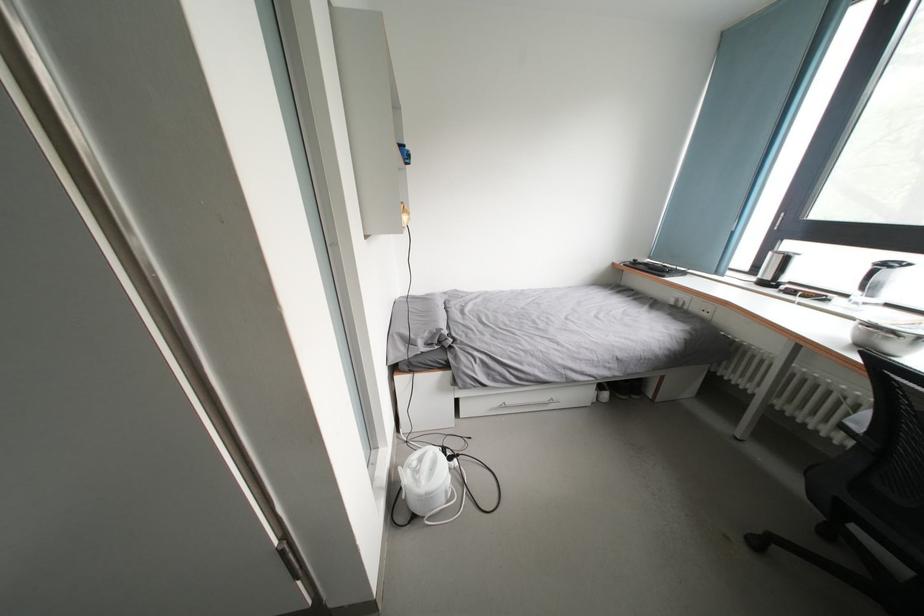
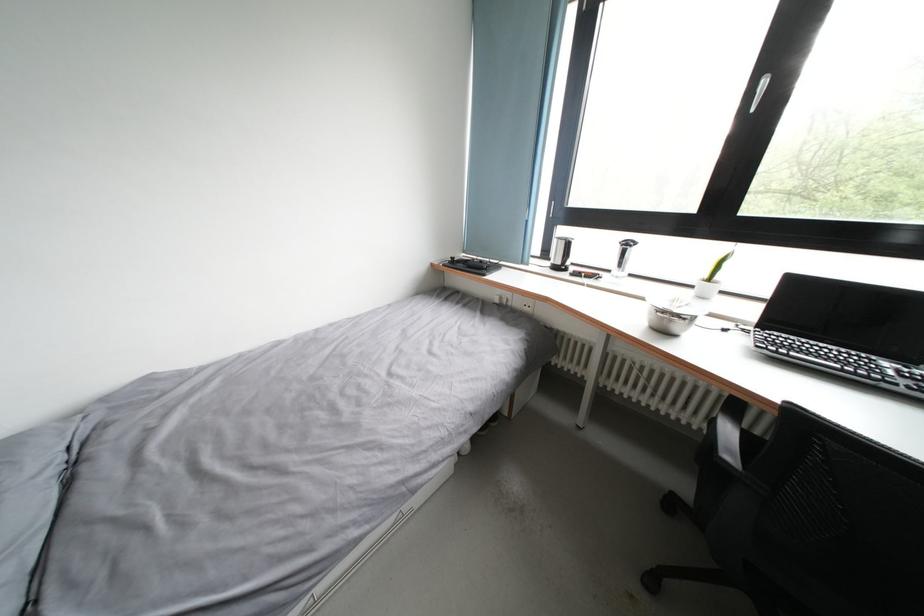
The point at (700, 312) is marked in the first image. Where is the corresponding point in the second image?

(524, 308)